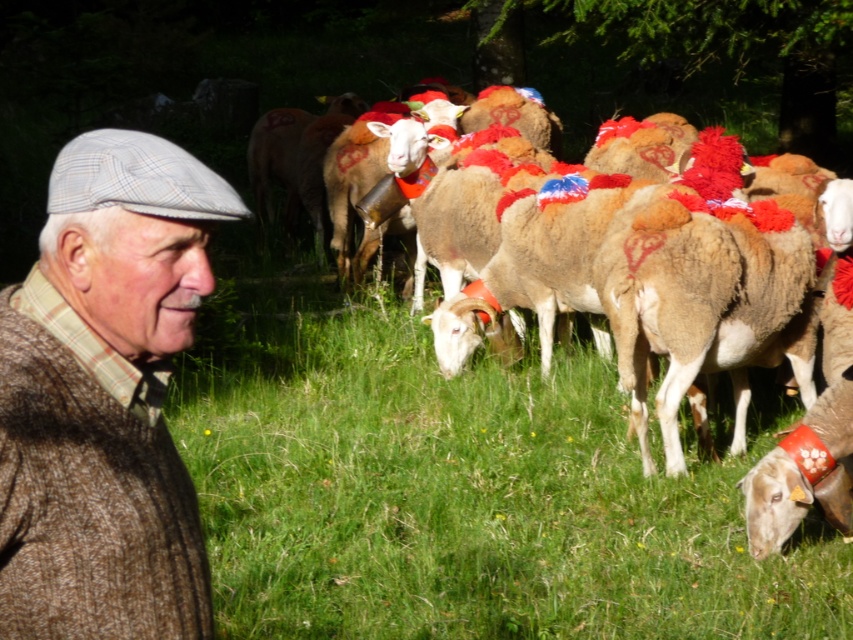
Question: Which object appears farthest from the camera in this image?

Choices:
 (A) brown woolen sheep at center
 (B) brown woolen sweater at left

Answer: (A)

Question: Which point is farther to the camera?

Choices:
 (A) brown woolen sweater at left
 (B) brown woolen sheep at center

Answer: (B)

Question: Which of the following is the farthest from the observer?

Choices:
 (A) (170, 195)
 (B) (706, 337)

Answer: (B)

Question: Is brown woolen sweater at left closer to camera compared to brown woolen sheep at center?

Choices:
 (A) yes
 (B) no

Answer: (A)

Question: Can you confirm if brown woolen sweater at left is positioned below brown woolen sheep at center?

Choices:
 (A) yes
 (B) no

Answer: (A)

Question: Can you confirm if brown woolen sweater at left is smaller than brown woolen sheep at center?

Choices:
 (A) yes
 (B) no

Answer: (A)